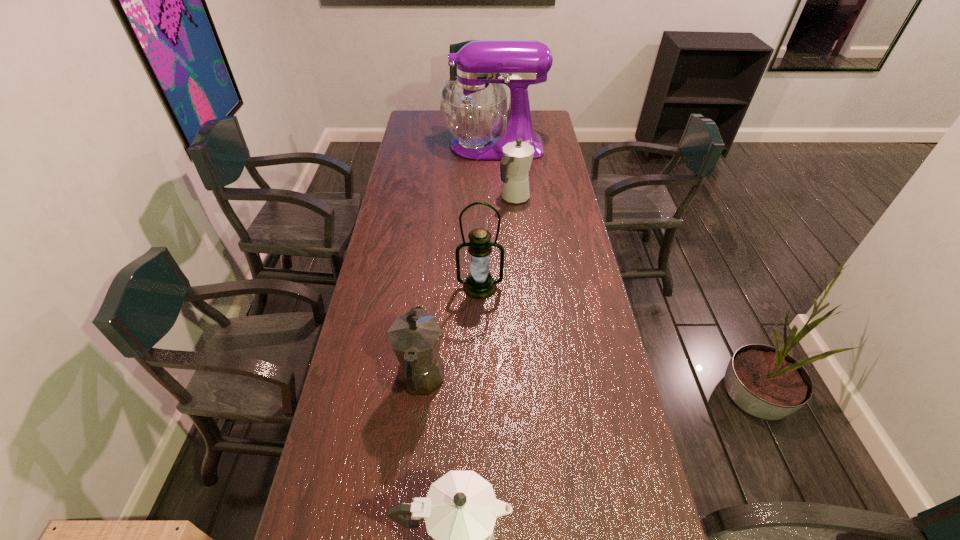
Choose which coffeepot is the nearest neighbor to the second nearest coffeepot. Please provide its 2D coordinates. Your answer should be formatted as a tuple, i.e. [(x, y)], where the tuple contains the x and y coordinates of a point satisfying the conditions above.

[(460, 510)]

Where is `blank space that satisfies the following two spatial constraints: 1. at the bowl opening of the second farthest object; 2. on the left side of the farthest object`? This screenshot has height=540, width=960. blank space that satisfies the following two spatial constraints: 1. at the bowl opening of the second farthest object; 2. on the left side of the farthest object is located at coordinates (495, 198).

Locate an element on the screen. This screenshot has width=960, height=540. free location that satisfies the following two spatial constraints: 1. at the bowl opening of the farthest object; 2. on the left side of the fourth nearest object is located at coordinates (495, 198).

Locate an element on the screen. vacant space that satisfies the following two spatial constraints: 1. at the bowl opening of the tallest object; 2. on the side where the third farthest object emits light is located at coordinates (499, 287).

The width and height of the screenshot is (960, 540). I want to click on vacant space that satisfies the following two spatial constraints: 1. on the pouring side of the farthest coffeepot; 2. on the left side of the fourth farthest object, so click(x=441, y=198).

The image size is (960, 540). In order to click on vacant region that satisfies the following two spatial constraints: 1. on the pouring side of the rightmost coffeepot; 2. on the left side of the fourth farthest object in this screenshot , I will do `click(441, 198)`.